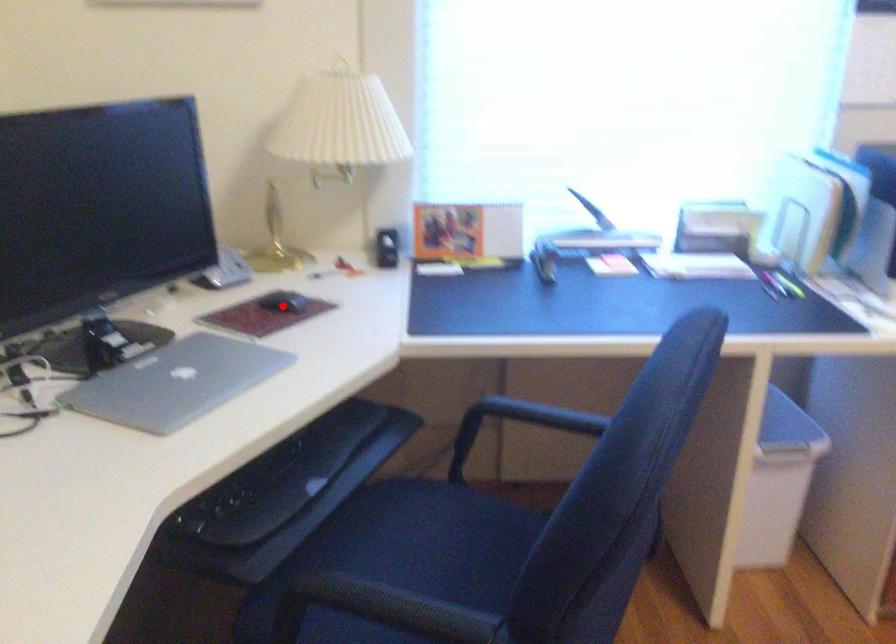
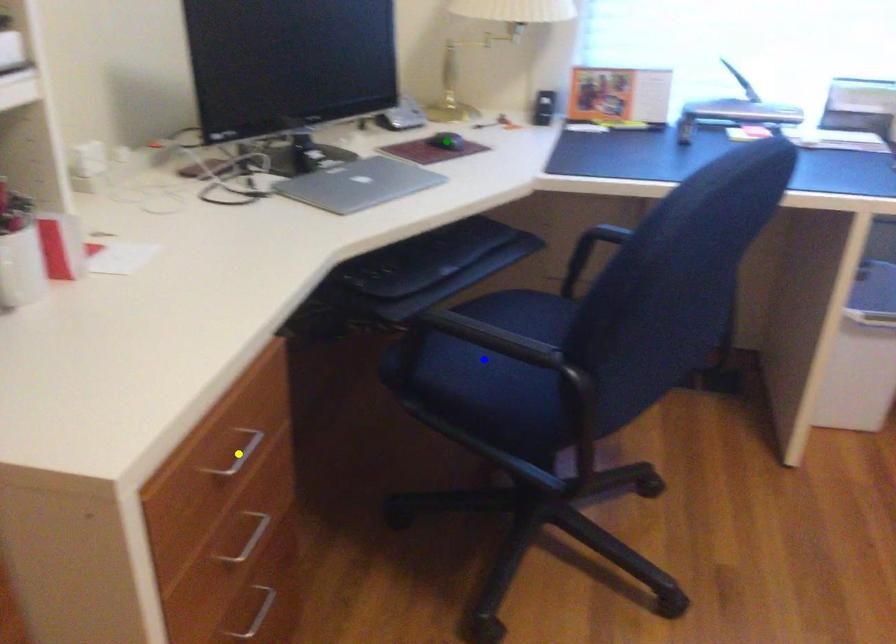
Question: I am providing you with two images of the same scene from different viewpoints. A red point is marked on the first image. You are given multiple points on the second image. Can you choose the point in image 2 that corresponds to the point in image 1?

Choices:
 (A) blue point
 (B) yellow point
 (C) green point

Answer: (C)